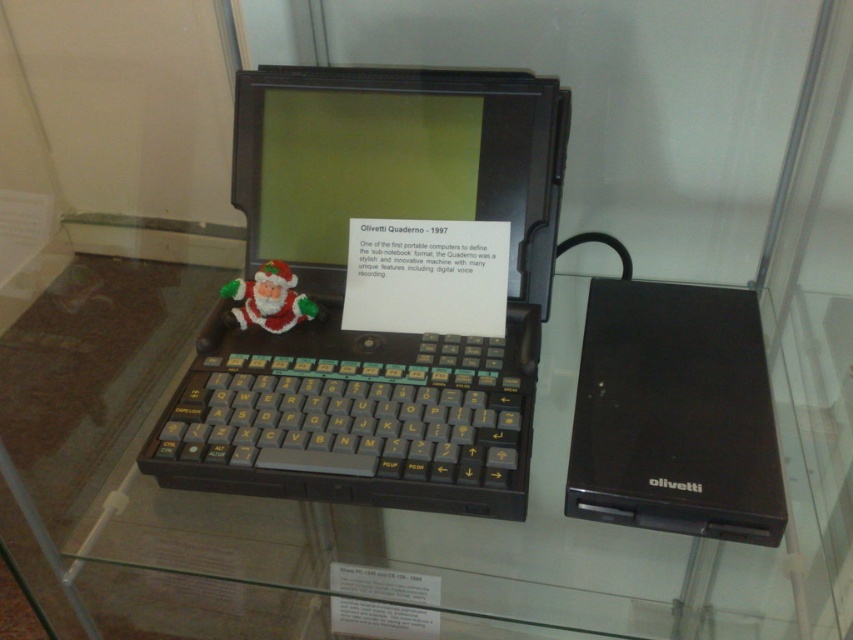
Question: Does black plastic laptop at center have a larger size compared to felt santa claus at center?

Choices:
 (A) no
 (B) yes

Answer: (B)

Question: Which point is farther to the camera?

Choices:
 (A) black plastic laptop at center
 (B) black plastic laptop at right
 (C) transparent glass table at center

Answer: (A)

Question: Where is transparent glass table at center located in relation to felt santa claus at center in the image?

Choices:
 (A) below
 (B) above

Answer: (A)

Question: Which point appears closest to the camera in this image?

Choices:
 (A) (312, 589)
 (B) (253, 280)
 (C) (469, 429)
 (D) (651, 310)

Answer: (A)

Question: Can you confirm if black plastic laptop at right is positioned to the left of felt santa claus at center?

Choices:
 (A) no
 (B) yes

Answer: (A)

Question: Among these points, which one is nearest to the camera?

Choices:
 (A) (224, 320)
 (B) (714, 520)
 (C) (451, 518)
 (D) (244, 208)

Answer: (B)